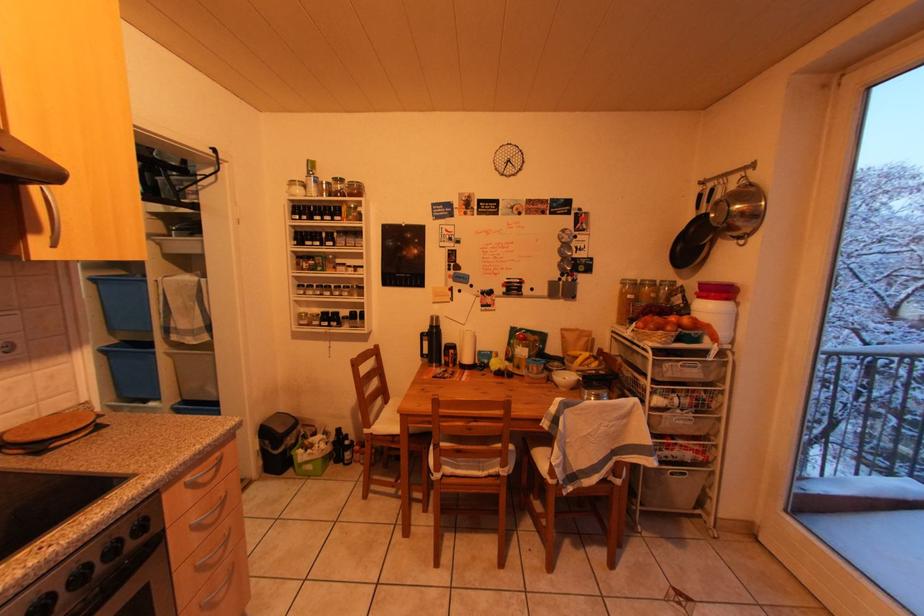
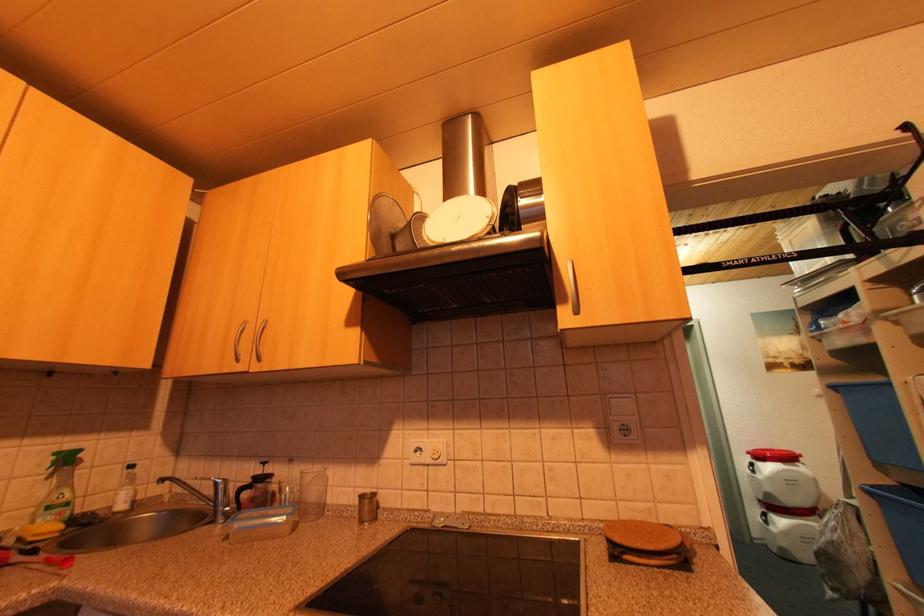
Question: The camera is either moving clockwise (left) or counter-clockwise (right) around the object. The first image is from the beginning of the video and the second image is from the end. Is the camera moving left or right when shooting the video?

Choices:
 (A) Left
 (B) Right

Answer: (B)